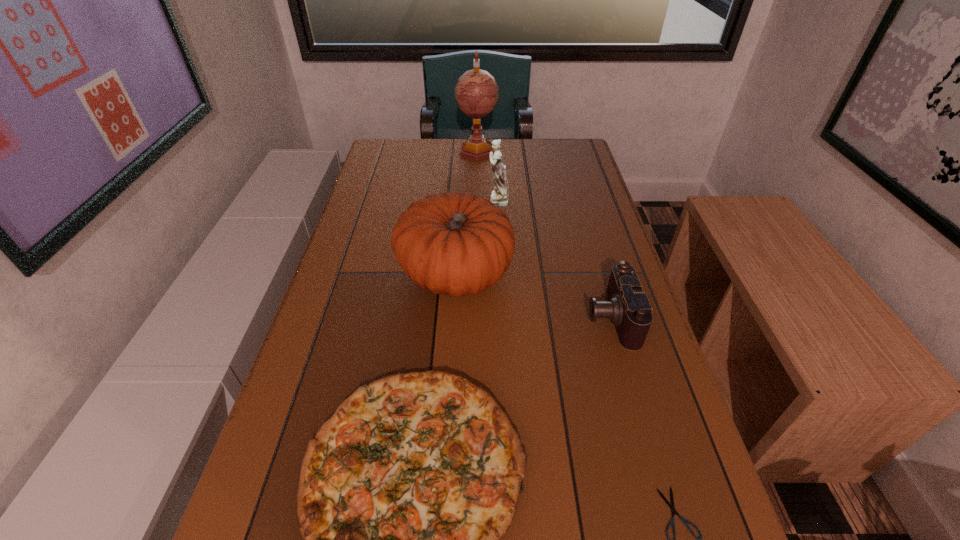
Where is `free location located 0.350m on the front-facing side of the fourth tallest object`? free location located 0.350m on the front-facing side of the fourth tallest object is located at coordinates pyautogui.click(x=433, y=318).

You are a GUI agent. You are given a task and a screenshot of the screen. Output one action in this format:
    pyautogui.click(x=<x>, y=<y>)
    Task: Click on the vacant space located on the front-facing side of the fourth tallest object
    The width and height of the screenshot is (960, 540).
    Given the screenshot: What is the action you would take?
    pyautogui.click(x=416, y=318)

Locate an element on the screen. The image size is (960, 540). vacant space located on the front-facing side of the fourth tallest object is located at coordinates (446, 318).

I want to click on object that is positioned at the far edge, so point(476,92).

Locate an element on the screen. object located at the right edge is located at coordinates (629, 309).

This screenshot has width=960, height=540. I want to click on vacant area at the far edge, so click(460, 147).

In the image, there is a desktop. In order to click on vacant space at the left edge in this screenshot , I will do `click(360, 338)`.

The image size is (960, 540). I want to click on free location at the right edge, so click(612, 332).

Locate an element on the screen. The height and width of the screenshot is (540, 960). free space at the far left corner of the desktop is located at coordinates (420, 152).

Select which object is the third closest to the globe. Please provide its 2D coordinates. Your answer should be formatted as a tuple, i.e. [(x, y)], where the tuple contains the x and y coordinates of a point satisfying the conditions above.

[(629, 309)]